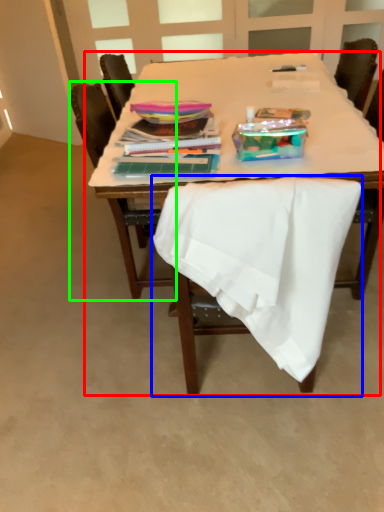
Question: Which object is the farthest from table (highlighted by a red box)? Choose among these: chair (highlighted by a blue box) or chair (highlighted by a green box).

Choices:
 (A) chair
 (B) chair

Answer: (A)